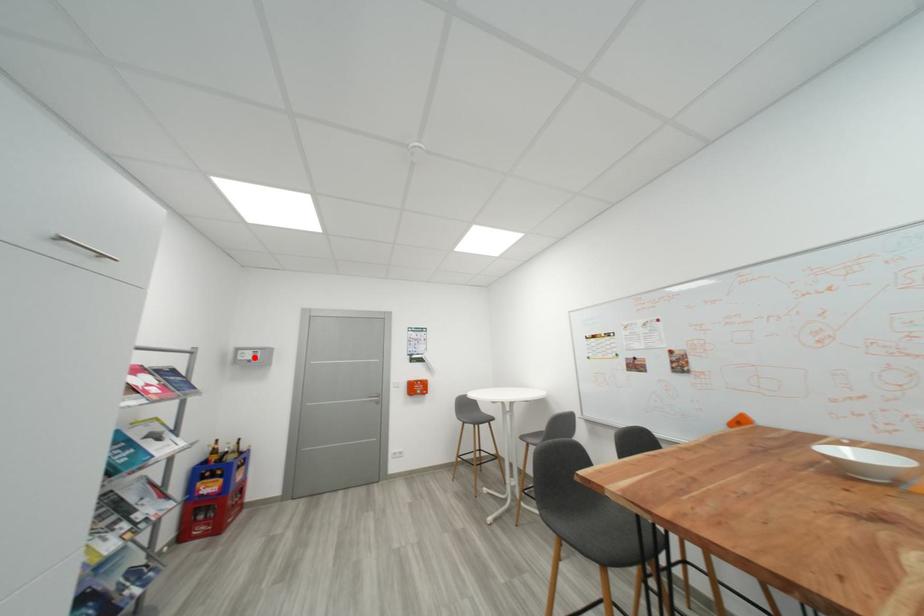
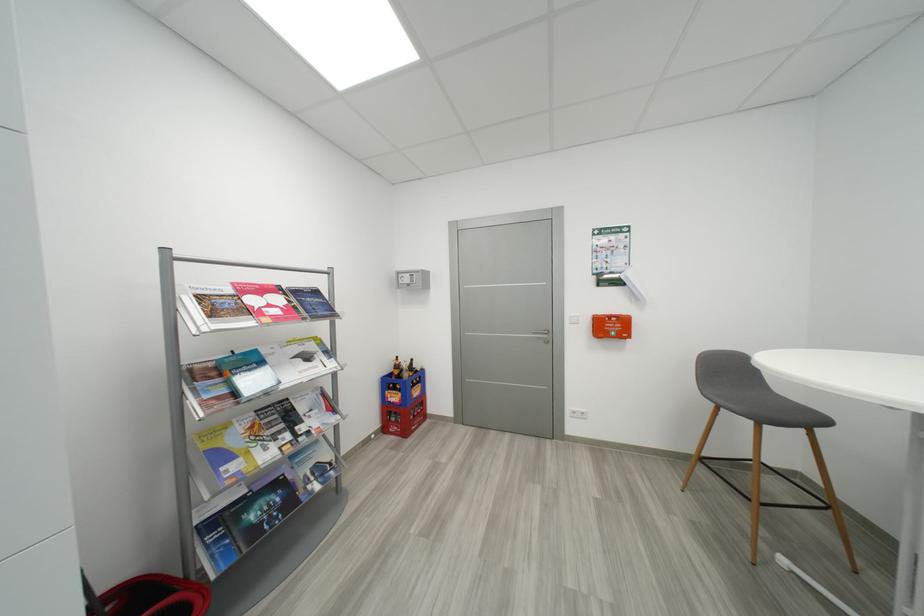
The point at the highlighted location is marked in the first image. Where is the corresponding point in the second image?

(412, 282)